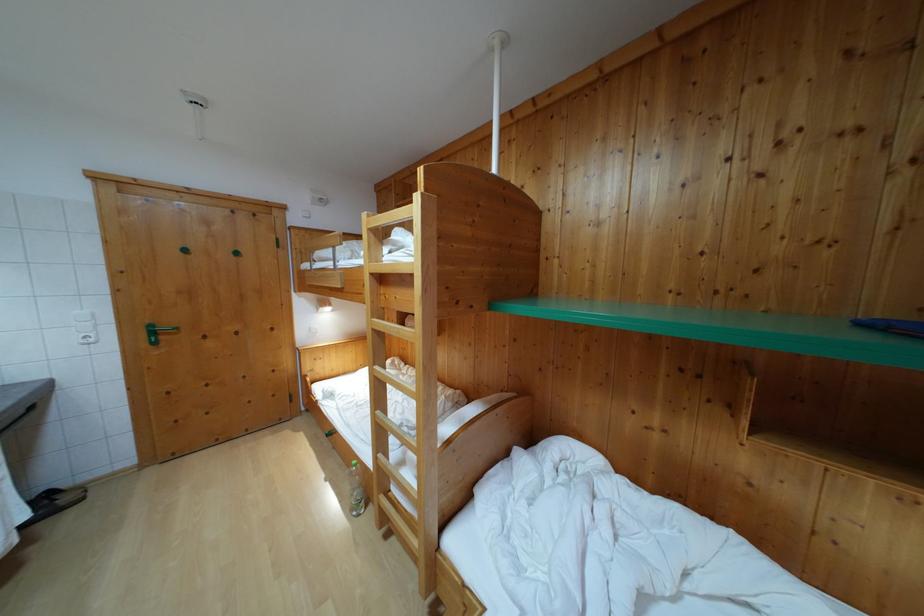
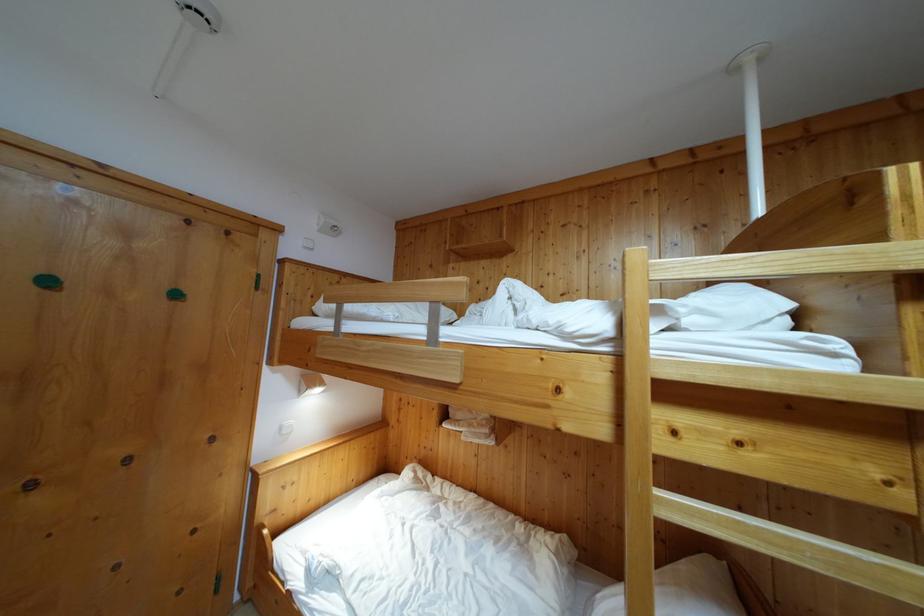
What movement of the cameraman would produce the second image?

The movement direction of the cameraman is left, forward.